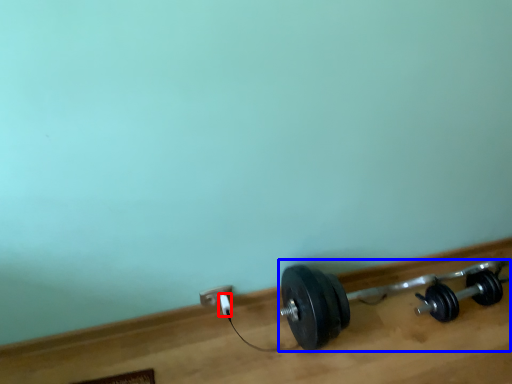
Question: Which object is closer to the camera taking this photo, plug (highlighted by a red box) or dumbbell (highlighted by a blue box)?

Choices:
 (A) plug
 (B) dumbbell

Answer: (B)